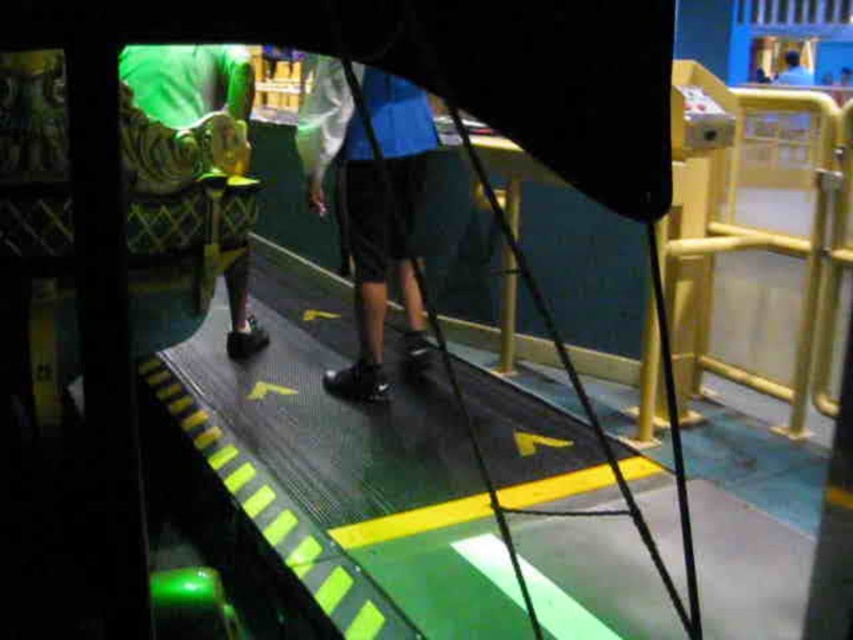
You are a game designer observing the gaming setup. You need to place a new sensor on the platform. The sensor must be placed between the shiny black shoes at center and the green quilted fabric at left. Is this possible given their positions?

The shiny black shoes at center is in front of green quilted fabric at left, so placing a sensor between them would require positioning it along the line connecting their positions. Since they are in a front and behind arrangement, a sensor can be placed between them along the depth axis.

You are a game designer analyzing the motion gaming setup. You notice the shiny black shoes at center and the green quilted fabric at left in the scene. Which object takes up more visual space in the image?

The shiny black shoes at center takes up more visual space in the image than the green quilted fabric at left because it is larger in size.